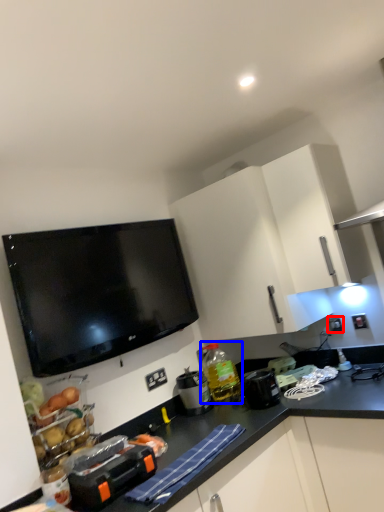
Question: Among these objects, which one is farthest to the camera, electric outlet (highlighted by a red box) or bottle (highlighted by a blue box)?

Choices:
 (A) electric outlet
 (B) bottle

Answer: (A)